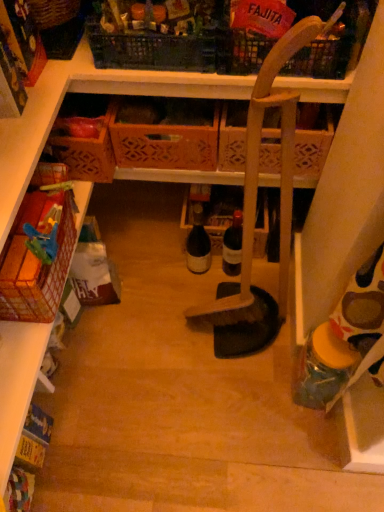
Locate an element on the screen. Image resolution: width=384 pixels, height=512 pixels. vacant space underneath wooden crate at center, the 5th basket positioned from the top (from a real-world perspective) is located at coordinates (115, 226).